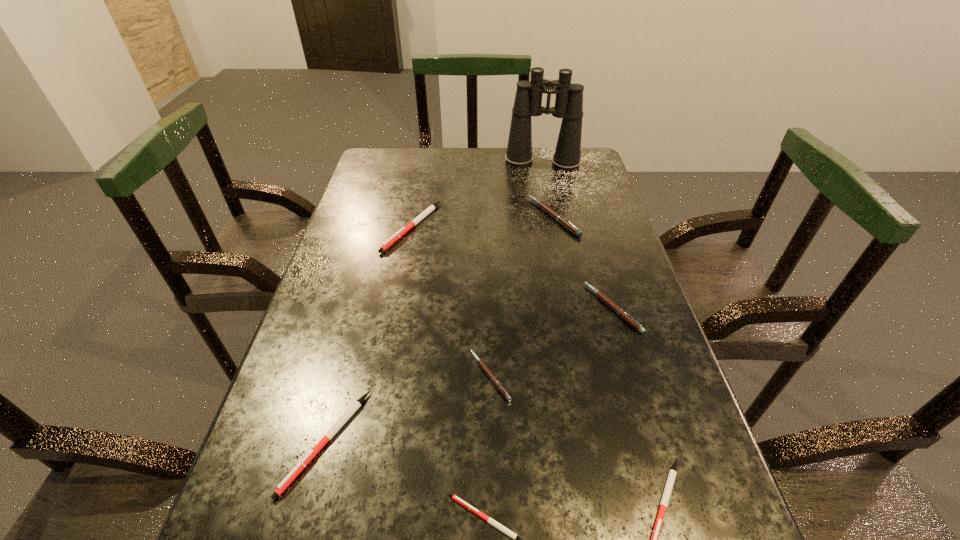
Find the location of `vacant point located between the biggest pink pen and the biggest white pen`. vacant point located between the biggest pink pen and the biggest white pen is located at coordinates click(483, 222).

Where is `free point between the farthest white pen and the tallest object`? The width and height of the screenshot is (960, 540). free point between the farthest white pen and the tallest object is located at coordinates (477, 194).

Locate an element on the screen. The height and width of the screenshot is (540, 960). vacant area between the second biggest pink pen and the leftmost pink pen is located at coordinates (552, 342).

You are a GUI agent. You are given a task and a screenshot of the screen. Output one action in this format:
    pyautogui.click(x=<x>, y=<y>)
    Task: Click on the object that stands as the sixth closest to the farthest pink pen
    The image size is (960, 540).
    Given the screenshot: What is the action you would take?
    pyautogui.click(x=672, y=474)

Find the location of a particular element. object that can be found as the seventh closest to the biggest pink pen is located at coordinates (517, 539).

Identify which pen is the second nearest to the shortest pen. Please provide its 2D coordinates. Your answer should be formatted as a tuple, i.e. [(x, y)], where the tuple contains the x and y coordinates of a point satisfying the conditions above.

[(672, 474)]

Select which pen is the fourth closest to the tallest object. Please provide its 2D coordinates. Your answer should be formatted as a tuple, i.e. [(x, y)], where the tuple contains the x and y coordinates of a point satisfying the conditions above.

[(494, 380)]

Identify which pink pen is the closest to the third smallest white pen. Please provide its 2D coordinates. Your answer should be formatted as a tuple, i.e. [(x, y)], where the tuple contains the x and y coordinates of a point satisfying the conditions above.

[(494, 380)]

Select which pink pen appears as the closest to the tallest object. Please provide its 2D coordinates. Your answer should be formatted as a tuple, i.e. [(x, y)], where the tuple contains the x and y coordinates of a point satisfying the conditions above.

[(563, 221)]

Identify the location of white pen that is the second nearest to the farthest white pen. This screenshot has width=960, height=540. (517, 539).